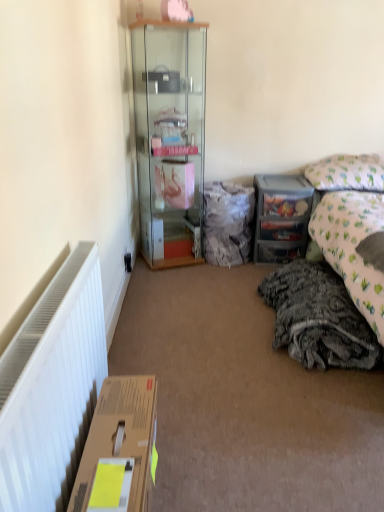
Question: From a real-world perspective, is fuzzy fabric bag at center above or below patterned fabric pillow at upper right?

Choices:
 (A) above
 (B) below

Answer: (B)

Question: Is fuzzy fabric bag at center situated inside patterned fabric pillow at upper right or outside?

Choices:
 (A) outside
 (B) inside

Answer: (A)

Question: Based on their relative distances, which object is nearer to the fuzzy fabric bag at center?

Choices:
 (A) black plastic power outlet at lower left
 (B) patterned fabric pillow at upper right
 (C) brown cardboard box at lower left
 (D) gray textured blanket at lower right
 (E) clear plastic drawers at center right

Answer: (E)

Question: Estimate the real-world distances between objects in this image. Which object is farther from the brown cardboard box at lower left?

Choices:
 (A) gray textured blanket at lower right
 (B) fuzzy fabric bag at center
 (C) transparent glass cabinet at center
 (D) patterned fabric pillow at upper right
 (E) black plastic power outlet at lower left

Answer: (D)